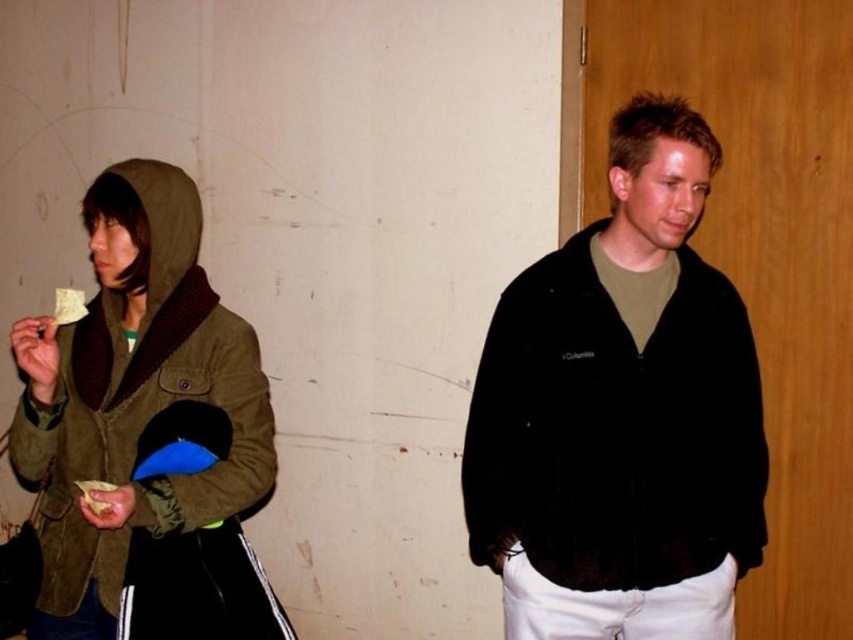
Question: Is black fleece jacket at right below yellow paper at left?

Choices:
 (A) yes
 (B) no

Answer: (A)

Question: Which point is closer to the camera taking this photo?

Choices:
 (A) (82, 305)
 (B) (102, 490)
 (C) (715, 557)
 (D) (178, 193)

Answer: (B)

Question: Is black fleece jacket at right behind yellow crumbly food at left?

Choices:
 (A) no
 (B) yes

Answer: (B)

Question: Is olive green suede jacket at left above yellow crumbly food at left?

Choices:
 (A) yes
 (B) no

Answer: (A)

Question: Which is nearer to the yellow paper at left?

Choices:
 (A) yellow crumbly food at left
 (B) olive green suede jacket at left

Answer: (B)

Question: Which of the following is the closest to the observer?

Choices:
 (A) (102, 488)
 (B) (68, 291)
 (C) (67, 333)
 (D) (554, 413)

Answer: (A)